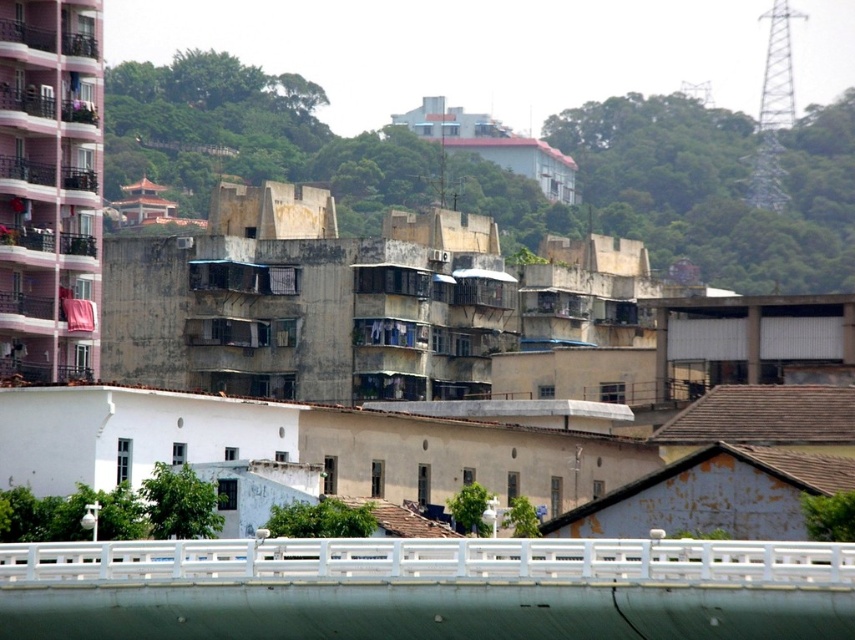
Question: Among these points, which one is nearest to the camera?

Choices:
 (A) (59, 630)
 (B) (712, 372)

Answer: (A)

Question: Is white concrete bridge at lower center closer to the viewer compared to white matte overpass at right?

Choices:
 (A) yes
 (B) no

Answer: (A)

Question: Is white concrete bridge at lower center bigger than white matte overpass at right?

Choices:
 (A) yes
 (B) no

Answer: (B)

Question: Is white concrete bridge at lower center positioned before white matte overpass at right?

Choices:
 (A) no
 (B) yes

Answer: (B)